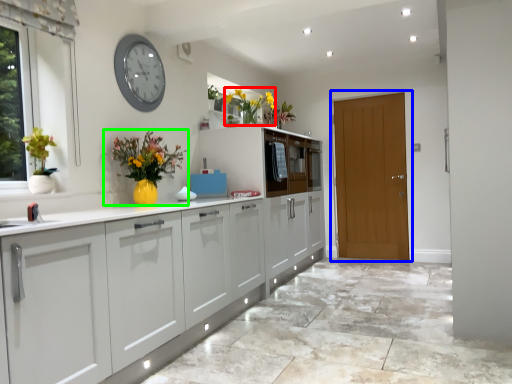
Question: Which object is positioned closest to floral arrangement (highlighted by a red box)? Select from door (highlighted by a blue box) and houseplant (highlighted by a green box).

Choices:
 (A) door
 (B) houseplant

Answer: (B)